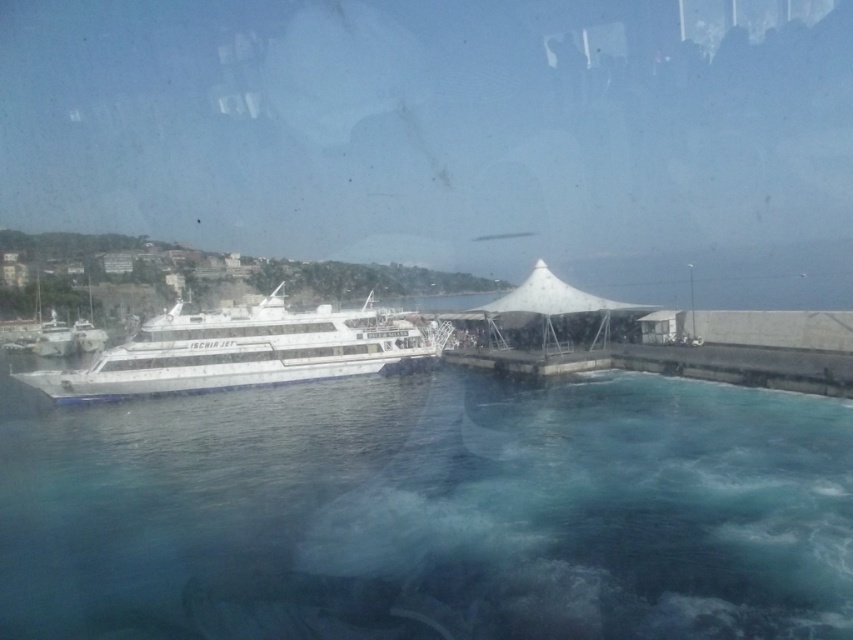
Question: Can you confirm if clear blue water at lower center is positioned to the left of white glossy cruise ship at center?

Choices:
 (A) yes
 (B) no

Answer: (B)

Question: Which object appears closest to the camera in this image?

Choices:
 (A) white glossy cruise ship at center
 (B) clear blue water at lower center
 (C) white fabric canopy at center

Answer: (B)

Question: Which object appears farthest from the camera in this image?

Choices:
 (A) white fabric canopy at center
 (B) white glossy cruise ship at center

Answer: (A)

Question: Which of these objects is positioned closest to the clear blue water at lower center?

Choices:
 (A) white fabric canopy at center
 (B) white glossy cruise ship at center

Answer: (B)

Question: Is the position of white glossy cruise ship at center less distant than that of white fabric canopy at center?

Choices:
 (A) yes
 (B) no

Answer: (A)

Question: Can you confirm if white glossy cruise ship at center is wider than white fabric canopy at center?

Choices:
 (A) no
 (B) yes

Answer: (B)